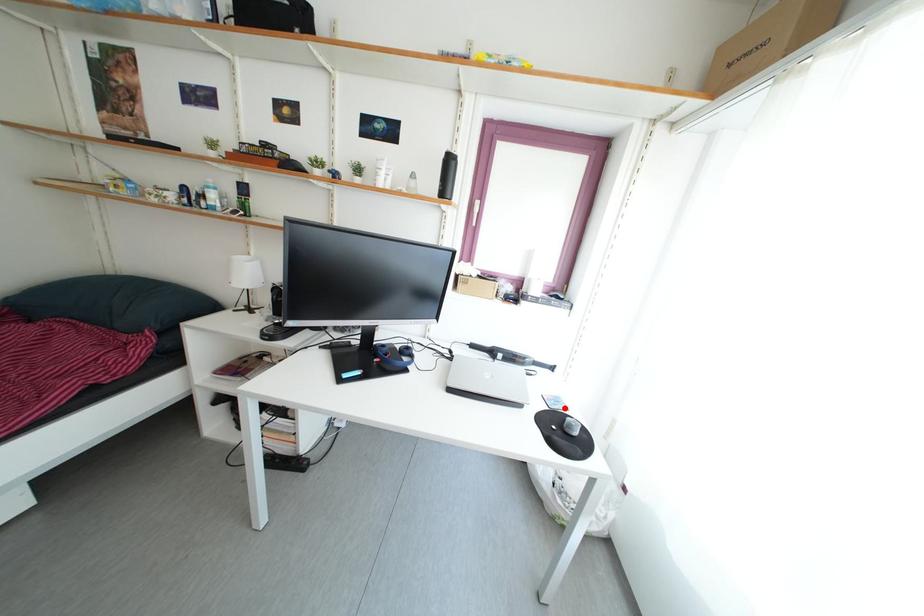
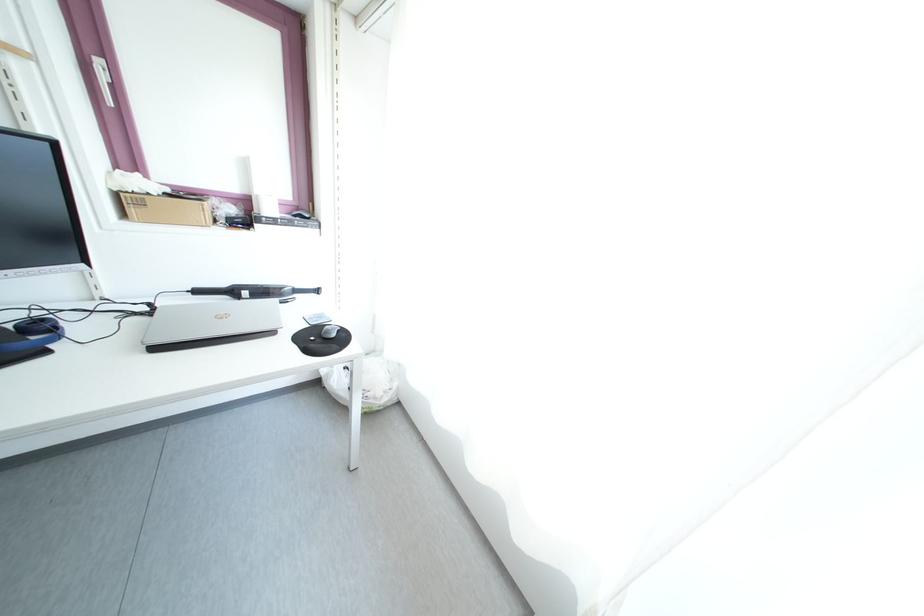
Where in the second image is the point corresponding to the highlighted location from the first image?

(327, 323)